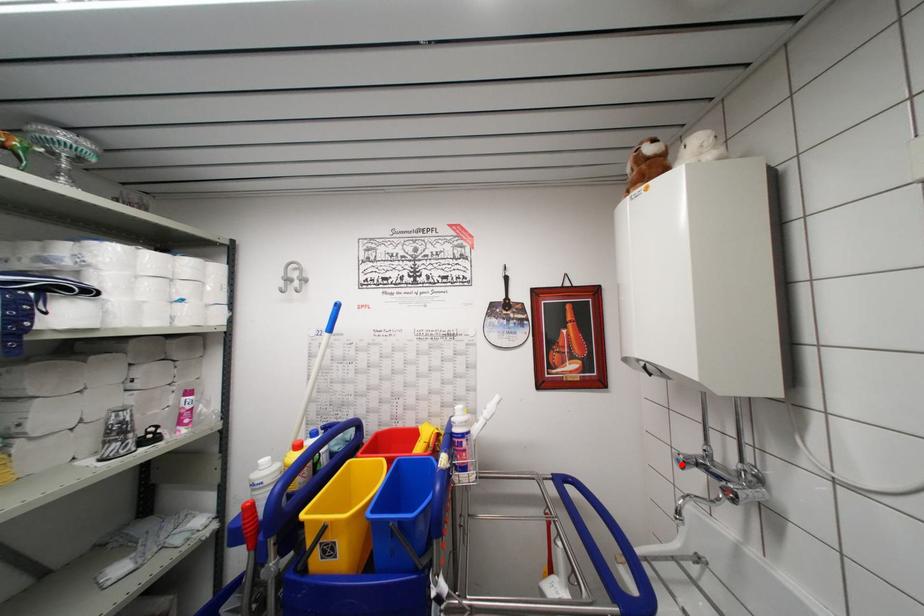
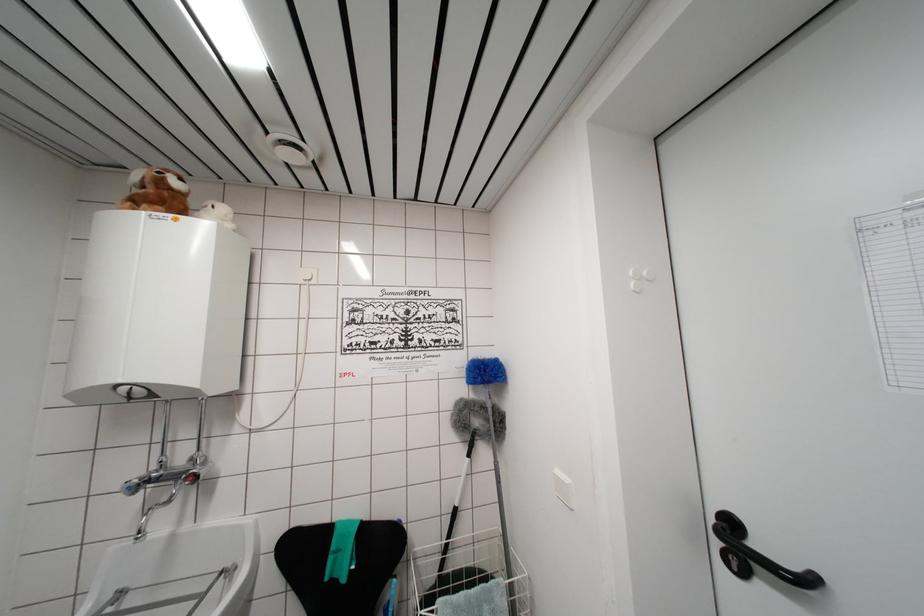
Where in the second image is the point corresponding to the highlighted location from the first image?

(132, 493)